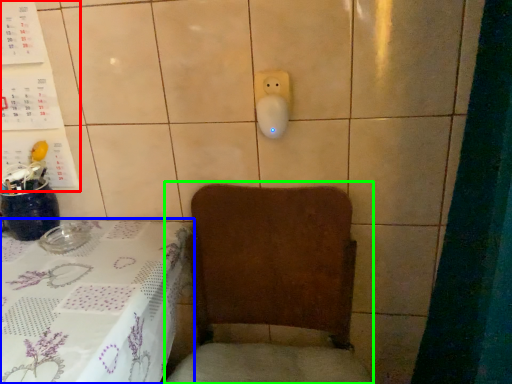
Question: Which is nearer to the bulletin board (highlighted by a red box)? furniture (highlighted by a blue box) or armchair (highlighted by a green box).

Choices:
 (A) furniture
 (B) armchair

Answer: (A)